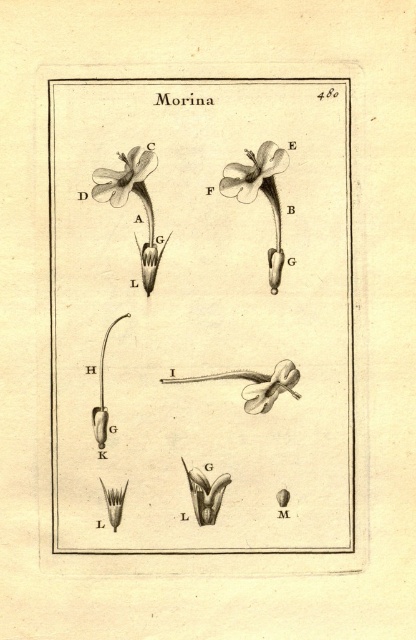
Between white paper flower at upper center and matte white flower at upper left, which one has more height?

Standing taller between the two is white paper flower at upper center.

The height and width of the screenshot is (640, 416). Identify the location of white paper flower at upper center. (255, 173).

The width and height of the screenshot is (416, 640). I want to click on white paper flower at upper center, so tap(255, 173).

Between white paper flower at upper center and matte white flower at center, which one has more height?

With more height is white paper flower at upper center.

Is point (257, 184) farther from viewer compared to point (296, 396)?

No.

Which is in front, point (249, 156) or point (286, 384)?

Point (249, 156) is in front.

You are a GUI agent. You are given a task and a screenshot of the screen. Output one action in this format:
    pyautogui.click(x=<x>, y=<y>)
    Task: Click on the white paper flower at upper center
    
    Given the screenshot: What is the action you would take?
    pyautogui.click(x=255, y=173)

Who is more forward, [183,129] or [240,188]?

Point [183,129] is more forward.

Identify the location of black ink pen at upper center. (203, 321).